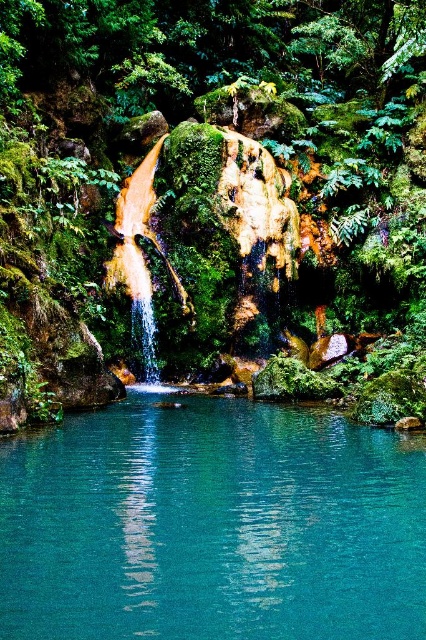
Question: Does green mossy rock at center appear under teal glass pool at center?

Choices:
 (A) no
 (B) yes

Answer: (A)

Question: Does green mossy rock at center appear under teal glass pool at center?

Choices:
 (A) yes
 (B) no

Answer: (B)

Question: Can you confirm if green mossy rock at center is bigger than teal glass pool at center?

Choices:
 (A) yes
 (B) no

Answer: (A)

Question: Which object is farther from the camera taking this photo?

Choices:
 (A) teal glass pool at center
 (B) green mossy rock at center

Answer: (B)